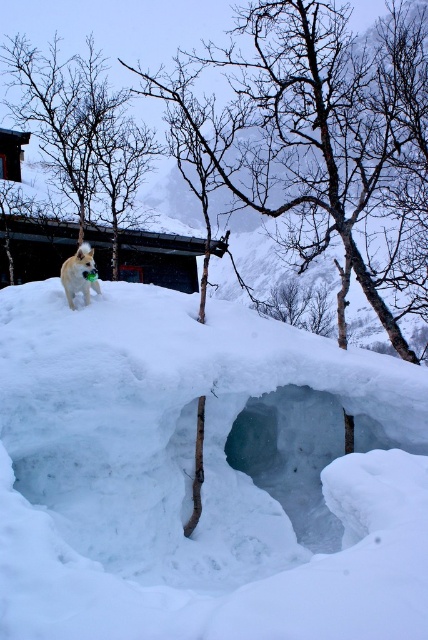
Which of these two, white fluffy snow at upper center or fluffy white dog at upper left, stands taller?

fluffy white dog at upper left

Between point (422, 509) and point (71, 305), which one is positioned in front?

Point (422, 509)

Find the location of a particular element. Image resolution: width=428 pixels, height=640 pixels. white fluffy snow at upper center is located at coordinates (190, 476).

Does white fluffy snow at upper center appear over brown bark tree at upper left?

Incorrect, white fluffy snow at upper center is not positioned above brown bark tree at upper left.

Is point (306, 609) farther from camera compared to point (91, 100)?

No, it is in front of (91, 100).

Image resolution: width=428 pixels, height=640 pixels. What are the coordinates of `white fluffy snow at upper center` in the screenshot? It's located at (190, 476).

Does brown bark tree at upper left appear on the left side of fluffy white dog at upper left?

Indeed, brown bark tree at upper left is positioned on the left side of fluffy white dog at upper left.

Based on the photo, can you confirm if brown bark tree at upper left is taller than fluffy white dog at upper left?

Correct, brown bark tree at upper left is much taller as fluffy white dog at upper left.

What do you see at coordinates (80, 129) in the screenshot? I see `brown bark tree at upper left` at bounding box center [80, 129].

The width and height of the screenshot is (428, 640). I want to click on brown bark tree at upper left, so click(80, 129).